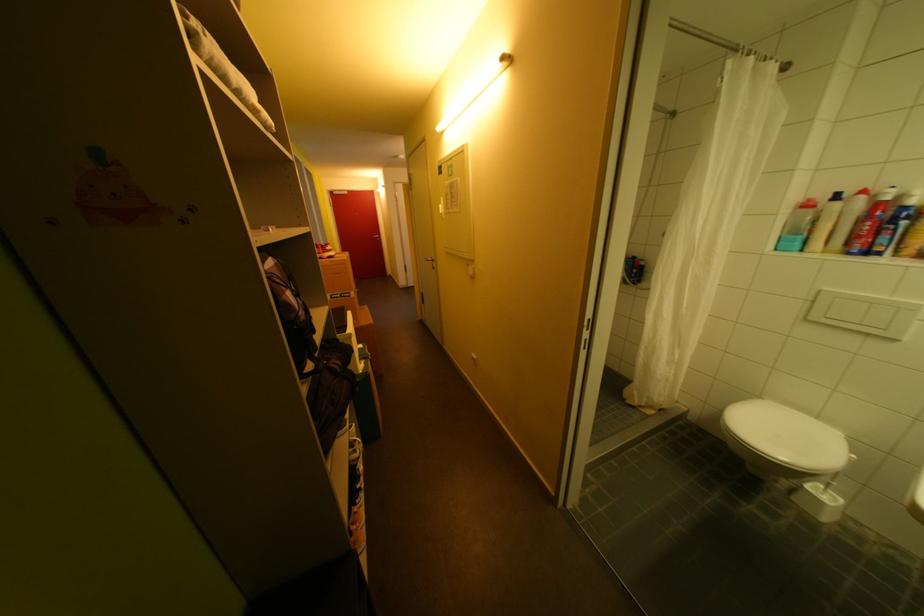
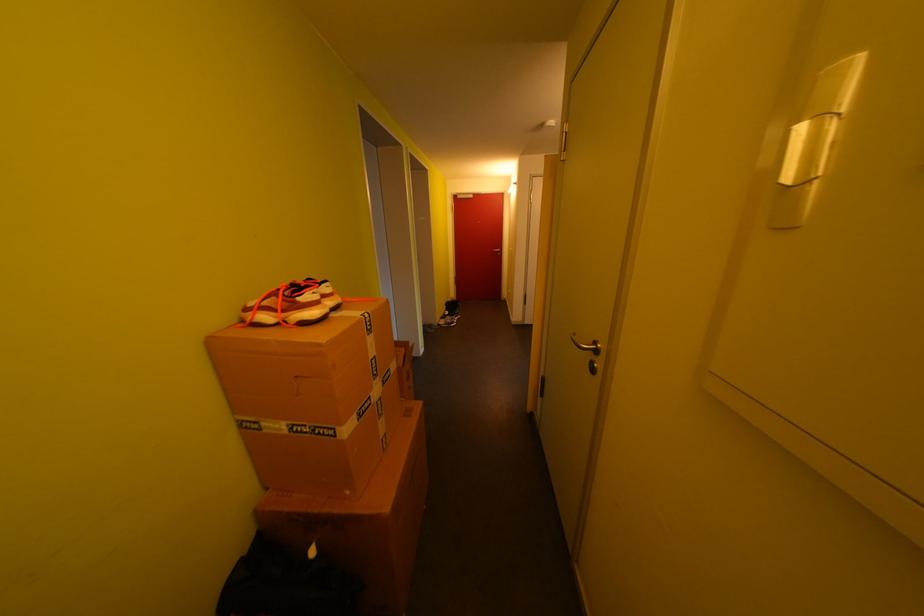
Question: Which direction would the cameraman need to move to produce the second image? Reply with the corresponding letter.

Choices:
 (A) Left
 (B) Right
 (C) Forward
 (D) Backward

Answer: (C)